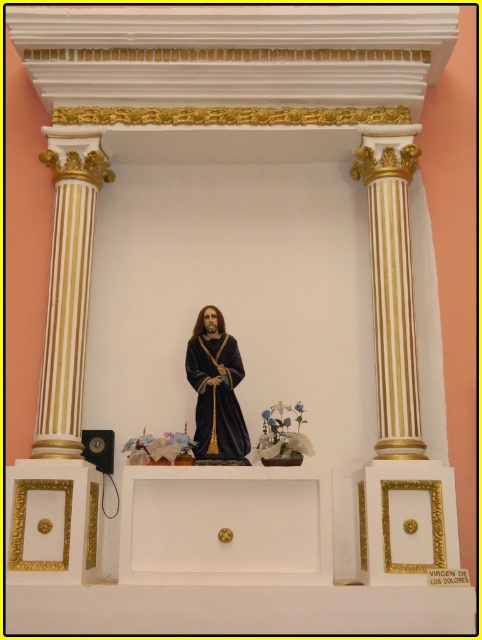
Can you confirm if gold striped column at right is bigger than velvet-like dark blue statue at center?

Indeed, gold striped column at right has a larger size compared to velvet-like dark blue statue at center.

Where is `gold striped column at right`? gold striped column at right is located at coordinates (391, 292).

Image resolution: width=482 pixels, height=640 pixels. I want to click on gold striped column at right, so click(x=391, y=292).

Consider the image. Between gold striped column at left and gold striped column at right, which one is positioned lower?

gold striped column at left

In the scene shown: Can you confirm if gold striped column at left is thinner than gold striped column at right?

Incorrect, gold striped column at left's width is not less than gold striped column at right's.

Which is behind, point (41, 384) or point (400, 332)?

Positioned behind is point (41, 384).

The image size is (482, 640). Find the location of `gold striped column at left`. gold striped column at left is located at coordinates (67, 291).

Does gold striped column at left have a lesser width compared to velvet-like dark blue statue at center?

No, gold striped column at left is not thinner than velvet-like dark blue statue at center.

Is gold striped column at left bigger than velvet-like dark blue statue at center?

Indeed, gold striped column at left has a larger size compared to velvet-like dark blue statue at center.

Find the location of a particular element. The width and height of the screenshot is (482, 640). gold striped column at left is located at coordinates (67, 291).